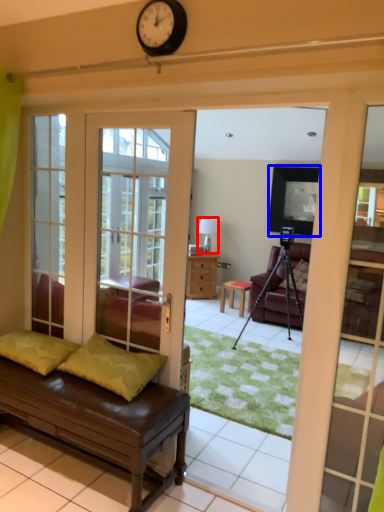
Question: Among these objects, which one is nearest to the camera, lamp (highlighted by a red box) or window screen (highlighted by a blue box)?

Choices:
 (A) lamp
 (B) window screen

Answer: (B)